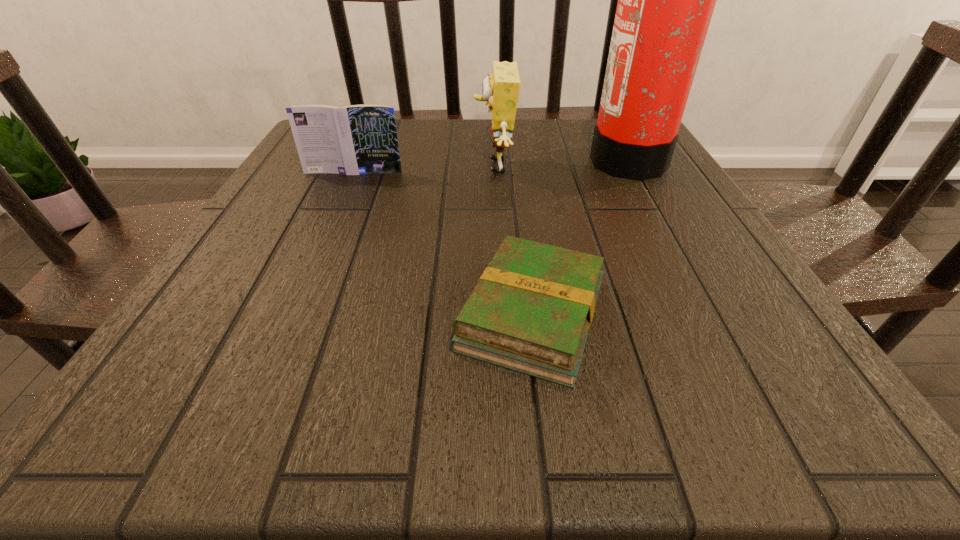
Locate an element on the screen. The height and width of the screenshot is (540, 960). vacant space that satisfies the following two spatial constraints: 1. on the back side of the shorter book; 2. on the face of the sponge is located at coordinates (514, 167).

Identify the location of free region that satisfies the following two spatial constraints: 1. on the front side of the rightmost object; 2. on the front side of the nearer book. (713, 315).

Identify the location of free space that satisfies the following two spatial constraints: 1. on the face of the sponge; 2. on the front cover of the farther book. (494, 172).

You are a GUI agent. You are given a task and a screenshot of the screen. Output one action in this format:
    pyautogui.click(x=<x>, y=<y>)
    Task: Click on the vacant space that satisfies the following two spatial constraints: 1. on the face of the sponge; 2. on the left side of the nearer book
    Image resolution: width=960 pixels, height=540 pixels.
    Given the screenshot: What is the action you would take?
    pyautogui.click(x=501, y=315)